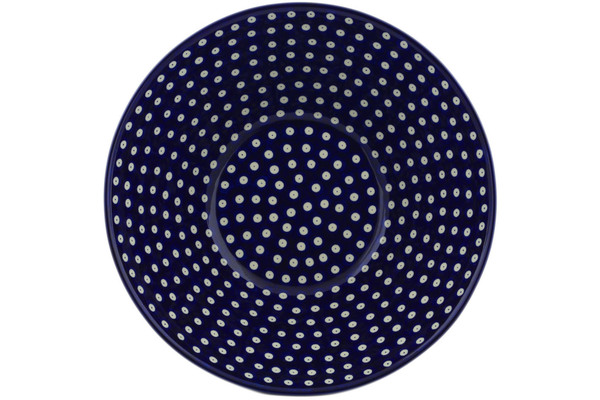
In order to click on outside rim of plate in this screenshot , I will do `click(198, 364)`.